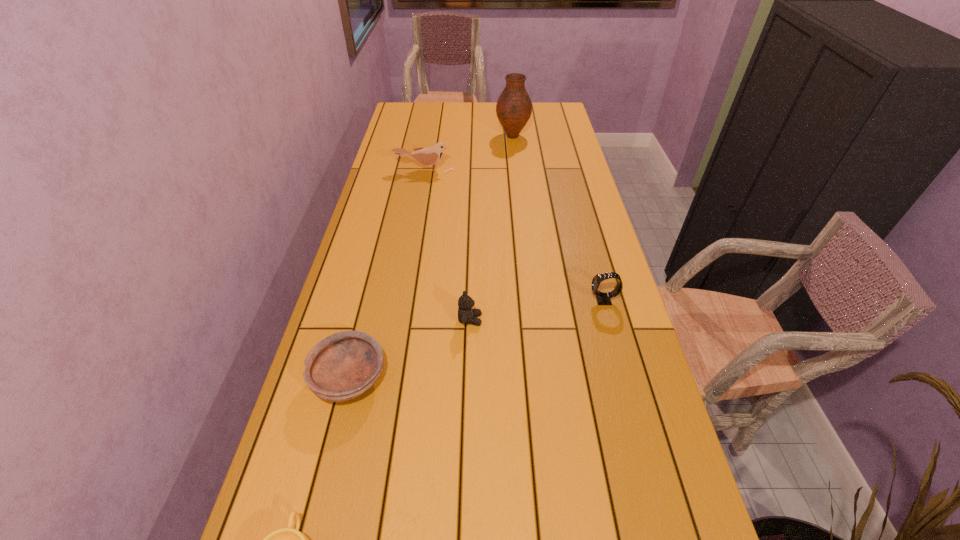
The image size is (960, 540). What are the coordinates of `free location located 0.210m on the back of the vase` in the screenshot? It's located at (510, 109).

Identify the location of vacant space situated at the beak of the bird. (415, 228).

At what (x,y) coordinates should I click in order to perform the action: click on free region located 0.400m on the face of the third farthest object. Please return your answer as a coordinate pair (x, y). Image resolution: width=960 pixels, height=540 pixels. Looking at the image, I should click on (444, 301).

You are a GUI agent. You are given a task and a screenshot of the screen. Output one action in this format:
    pyautogui.click(x=<x>, y=<y>)
    Task: Click on the vacant space located 0.150m on the face of the third farthest object
    
    Given the screenshot: What is the action you would take?
    pyautogui.click(x=535, y=301)

At what (x,y) coordinates should I click in order to perform the action: click on free region located 0.090m on the face of the third farthest object. Please return your answer as a coordinate pair (x, y). Looking at the image, I should click on (557, 301).

In order to click on vacant region located 0.110m on the face of the teddy bear in this screenshot , I will do `click(524, 320)`.

This screenshot has height=540, width=960. Find the location of `free spot located 0.050m on the right of the fifth tallest object`. free spot located 0.050m on the right of the fifth tallest object is located at coordinates (408, 379).

Where is `bird that is at the left edge`? This screenshot has height=540, width=960. bird that is at the left edge is located at coordinates (429, 156).

Locate an element on the screen. bowl that is at the left edge is located at coordinates (344, 365).

Identify the location of object present at the right edge. Image resolution: width=960 pixels, height=540 pixels. (602, 298).